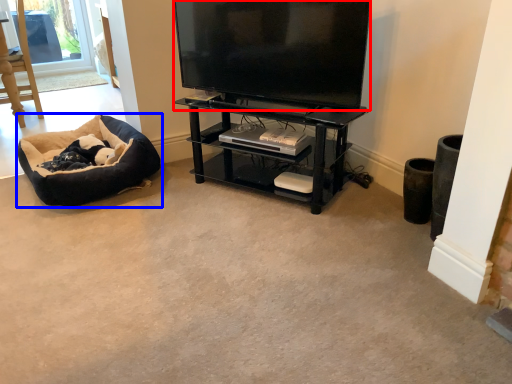
Question: Which point is closer to the camera, television (highlighted by a red box) or dog bed (highlighted by a blue box)?

Choices:
 (A) television
 (B) dog bed

Answer: (A)